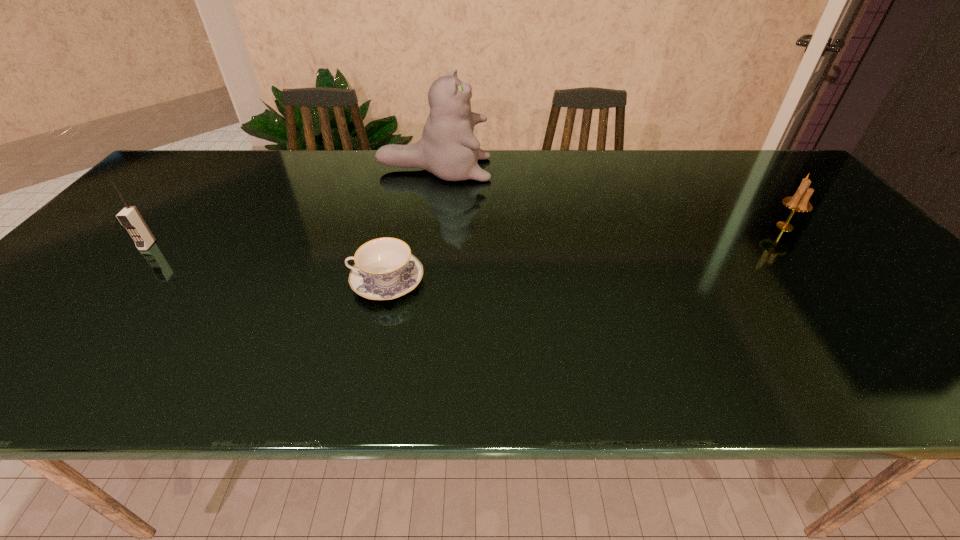
You are a GUI agent. You are given a task and a screenshot of the screen. Output one action in this format:
    pyautogui.click(x=<x>, y=<y>)
    Task: Click on the object that is the second nearest to the leftmost object
    
    Given the screenshot: What is the action you would take?
    pyautogui.click(x=448, y=148)

Where is `object that stands as the closest to the candle holder`? object that stands as the closest to the candle holder is located at coordinates (448, 148).

The width and height of the screenshot is (960, 540). I want to click on free point that satisfies the following two spatial constraints: 1. on the front-facing side of the third farthest object; 2. with the handle on the side of the shortest object, so click(116, 281).

The width and height of the screenshot is (960, 540). Identify the location of free location that satisfies the following two spatial constraints: 1. on the face of the tallest object; 2. on the front-facing side of the leftmost object. (422, 245).

I want to click on vacant point that satisfies the following two spatial constraints: 1. on the face of the rightmost object; 2. on the left side of the farthest object, so click(425, 226).

Image resolution: width=960 pixels, height=540 pixels. In order to click on vacant space that satisfies the following two spatial constraints: 1. with the handle on the side of the nearest object; 2. on the right side of the rightmost object in this screenshot , I will do `click(399, 226)`.

Identify the location of blank area in the image that satisfies the following two spatial constraints: 1. on the face of the candle holder; 2. on the right side of the tallest object. The image size is (960, 540). (425, 226).

Where is `vacant space that satisfies the following two spatial constraints: 1. with the handle on the side of the shortest object; 2. on the front-facing side of the cellular telephone`? The image size is (960, 540). vacant space that satisfies the following two spatial constraints: 1. with the handle on the side of the shortest object; 2. on the front-facing side of the cellular telephone is located at coordinates (395, 245).

Locate an element on the screen. This screenshot has width=960, height=540. free space that satisfies the following two spatial constraints: 1. with the handle on the side of the nearest object; 2. on the right side of the candle holder is located at coordinates (399, 226).

The height and width of the screenshot is (540, 960). In order to click on vacant area in the image that satisfies the following two spatial constraints: 1. on the face of the tallest object; 2. on the front-facing side of the second nearest object in this screenshot , I will do `click(422, 245)`.